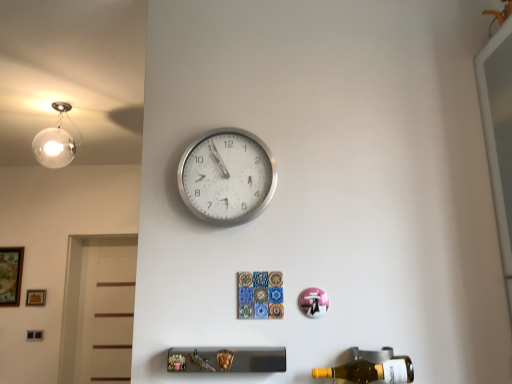
What do you see at coordinates (371, 368) in the screenshot? This screenshot has height=384, width=512. I see `yellow glass bottle at lower right` at bounding box center [371, 368].

Where is `wooden picture frame at lower left, which is the 2th picture frame from left to right`? The image size is (512, 384). wooden picture frame at lower left, which is the 2th picture frame from left to right is located at coordinates (36, 297).

Considering the points (35, 301) and (6, 266), which point is behind, point (35, 301) or point (6, 266)?

The point (6, 266) is farther.

From the image's perspective, is wooden picture frame at lower left, which is the 2th picture frame from left to right, over wooden framed artwork at left, the first picture frame from the left?

No.

Which of these two, wooden picture frame at lower left, the 1th picture frame viewed from the right, or wooden framed artwork at left, which ranks as the 2th picture frame in right-to-left order, is wider?

Wider between the two is wooden framed artwork at left, which ranks as the 2th picture frame in right-to-left order.

I want to click on picture frame located above the wooden picture frame at lower left, the 1th picture frame viewed from the right (from the image's perspective), so click(x=10, y=275).

Considering the sizes of objects wooden framed artwork at left, the first picture frame from the left, and silver metallic wall clock at upper center in the image provided, who is thinner, wooden framed artwork at left, the first picture frame from the left, or silver metallic wall clock at upper center?

Thinner between the two is wooden framed artwork at left, the first picture frame from the left.

From a real-world perspective, is wooden framed artwork at left, the first picture frame from the left, over silver metallic wall clock at upper center?

No.

Who is shorter, wooden framed artwork at left, the first picture frame from the left, or silver metallic wall clock at upper center?

silver metallic wall clock at upper center.

Can we say wooden framed artwork at left, which ranks as the 2th picture frame in right-to-left order, lies outside silver metallic wall clock at upper center?

Absolutely, wooden framed artwork at left, which ranks as the 2th picture frame in right-to-left order, is external to silver metallic wall clock at upper center.

From the picture: From the image's perspective, would you say yellow glass bottle at lower right is shown under wooden framed artwork at left, the first picture frame from the left?

No, from the image's perspective, yellow glass bottle at lower right is not beneath wooden framed artwork at left, the first picture frame from the left.

Can you confirm if yellow glass bottle at lower right is positioned to the left of wooden framed artwork at left, which ranks as the 2th picture frame in right-to-left order?

In fact, yellow glass bottle at lower right is to the right of wooden framed artwork at left, which ranks as the 2th picture frame in right-to-left order.

Is yellow glass bottle at lower right positioned with its back to wooden framed artwork at left, the first picture frame from the left?

yellow glass bottle at lower right is not turned away from wooden framed artwork at left, the first picture frame from the left.

How different are the orientations of yellow glass bottle at lower right and wooden framed artwork at left, the first picture frame from the left, in degrees?

They differ by 0.273 degrees in their facing directions.

Which object is positioned more to the left, silver metallic wall clock at upper center or yellow glass bottle at lower right?

Positioned to the left is silver metallic wall clock at upper center.

Can you confirm if silver metallic wall clock at upper center is taller than yellow glass bottle at lower right?

Yes.

Can you tell me how much silver metallic wall clock at upper center and yellow glass bottle at lower right differ in facing direction?

There is a 0.419-degree angle between the facing directions of silver metallic wall clock at upper center and yellow glass bottle at lower right.

Can you tell me how much wooden framed artwork at left, which ranks as the 2th picture frame in right-to-left order, and yellow glass bottle at lower right differ in facing direction?

The angular difference between wooden framed artwork at left, which ranks as the 2th picture frame in right-to-left order, and yellow glass bottle at lower right is 0.273 degrees.

Is wooden framed artwork at left, which ranks as the 2th picture frame in right-to-left order, shorter than yellow glass bottle at lower right?

Incorrect, the height of wooden framed artwork at left, which ranks as the 2th picture frame in right-to-left order, does not fall short of that of yellow glass bottle at lower right.

Is point (8, 256) closer to camera compared to point (391, 365)?

That is False.

Is wooden framed artwork at left, which ranks as the 2th picture frame in right-to-left order, looking in the opposite direction of yellow glass bottle at lower right?

No, yellow glass bottle at lower right is not at the back of wooden framed artwork at left, which ranks as the 2th picture frame in right-to-left order.

Is yellow glass bottle at lower right completely or partially outside of wooden picture frame at lower left, which is the 2th picture frame from left to right?

Yes, yellow glass bottle at lower right is outside of wooden picture frame at lower left, which is the 2th picture frame from left to right.

From the image's perspective, which is below, yellow glass bottle at lower right or wooden picture frame at lower left, the 1th picture frame viewed from the right?

wooden picture frame at lower left, the 1th picture frame viewed from the right, from the image's perspective.

Is there a large distance between yellow glass bottle at lower right and wooden picture frame at lower left, which is the 2th picture frame from left to right?

Yes.

Which is farther from the camera, (x=44, y=303) or (x=186, y=164)?

The point (x=44, y=303) is farther.

Considering the sizes of wooden picture frame at lower left, which is the 2th picture frame from left to right, and silver metallic wall clock at upper center in the image, is wooden picture frame at lower left, which is the 2th picture frame from left to right, wider or thinner than silver metallic wall clock at upper center?

wooden picture frame at lower left, which is the 2th picture frame from left to right, is thinner than silver metallic wall clock at upper center.

Is wooden picture frame at lower left, the 1th picture frame viewed from the right, facing towards silver metallic wall clock at upper center?

No, wooden picture frame at lower left, the 1th picture frame viewed from the right, is not facing towards silver metallic wall clock at upper center.

From the image's perspective, is wooden picture frame at lower left, the 1th picture frame viewed from the right, positioned above or below silver metallic wall clock at upper center?

Clearly, from the image's perspective, wooden picture frame at lower left, the 1th picture frame viewed from the right, is below silver metallic wall clock at upper center.

The width and height of the screenshot is (512, 384). I want to click on picture frame on the right of wooden framed artwork at left, the first picture frame from the left, so click(x=36, y=297).

Which picture frame is the 2nd one when counting from the left side of the silver metallic wall clock at upper center? Please provide its 2D coordinates.

[(10, 275)]

Considering their positions, is silver metallic wall clock at upper center positioned further to wooden picture frame at lower left, which is the 2th picture frame from left to right, than yellow glass bottle at lower right?

The object further to wooden picture frame at lower left, which is the 2th picture frame from left to right, is yellow glass bottle at lower right.

Estimate the real-world distances between objects in this image. Which object is closer to silver metallic wall clock at upper center, wooden picture frame at lower left, the 1th picture frame viewed from the right, or yellow glass bottle at lower right?

yellow glass bottle at lower right is positioned closer to the anchor silver metallic wall clock at upper center.

Estimate the real-world distances between objects in this image. Which object is closer to silver metallic wall clock at upper center, yellow glass bottle at lower right or wooden picture frame at lower left, which is the 2th picture frame from left to right?

Based on the image, yellow glass bottle at lower right appears to be nearer to silver metallic wall clock at upper center.

Based on their spatial positions, is wooden picture frame at lower left, which is the 2th picture frame from left to right, or silver metallic wall clock at upper center closer to yellow glass bottle at lower right?

Based on the image, silver metallic wall clock at upper center appears to be nearer to yellow glass bottle at lower right.

Looking at the image, which one is located closer to wooden picture frame at lower left, the 1th picture frame viewed from the right, yellow glass bottle at lower right or silver metallic wall clock at upper center?

silver metallic wall clock at upper center is positioned closer to the anchor wooden picture frame at lower left, the 1th picture frame viewed from the right.

Based on their spatial positions, is silver metallic wall clock at upper center or wooden framed artwork at left, the first picture frame from the left, further from yellow glass bottle at lower right?

wooden framed artwork at left, the first picture frame from the left, is further to yellow glass bottle at lower right.

Considering their positions, is wooden picture frame at lower left, which is the 2th picture frame from left to right, positioned closer to silver metallic wall clock at upper center than wooden framed artwork at left, the first picture frame from the left?

wooden picture frame at lower left, which is the 2th picture frame from left to right, lies closer to silver metallic wall clock at upper center than the other object.

From the image, which object appears to be nearer to yellow glass bottle at lower right, wooden framed artwork at left, the first picture frame from the left, or silver metallic wall clock at upper center?

Based on the image, silver metallic wall clock at upper center appears to be nearer to yellow glass bottle at lower right.

The image size is (512, 384). I want to click on wall clock positioned between yellow glass bottle at lower right and wooden framed artwork at left, which ranks as the 2th picture frame in right-to-left order, from near to far, so click(x=227, y=176).

Locate an element on the screen. The image size is (512, 384). wall clock between yellow glass bottle at lower right and wooden picture frame at lower left, which is the 2th picture frame from left to right, in the front-back direction is located at coordinates (227, 176).

In order to click on picture frame between yellow glass bottle at lower right and wooden framed artwork at left, the first picture frame from the left, from front to back in this screenshot , I will do `click(36, 297)`.

The width and height of the screenshot is (512, 384). Identify the location of picture frame positioned between silver metallic wall clock at upper center and wooden framed artwork at left, the first picture frame from the left, from near to far. (36, 297).